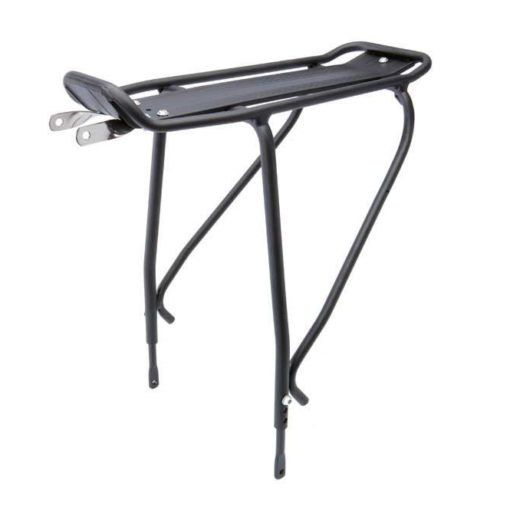
I want to click on front of the seat, so click(86, 80).